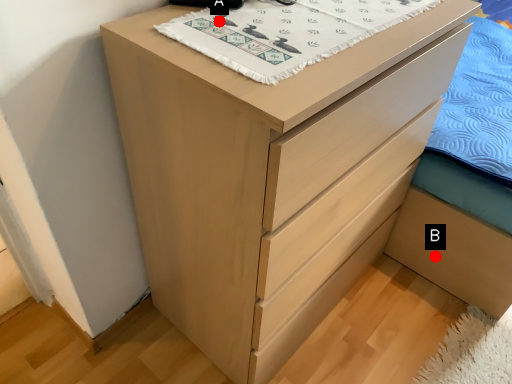
Question: Two points are circled on the image, labeled by A and B beside each circle. Which point is closer to the camera?

Choices:
 (A) A is closer
 (B) B is closer

Answer: (A)